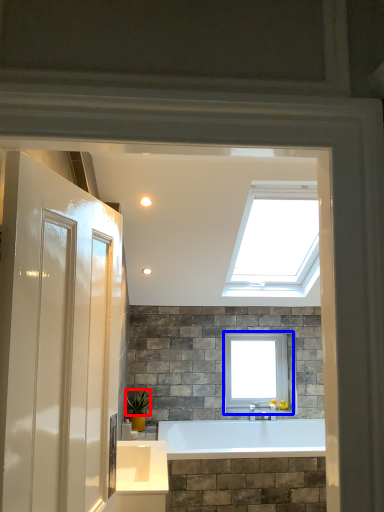
Question: Among these objects, which one is farthest to the camera, plant (highlighted by a red box) or window (highlighted by a blue box)?

Choices:
 (A) plant
 (B) window

Answer: (B)